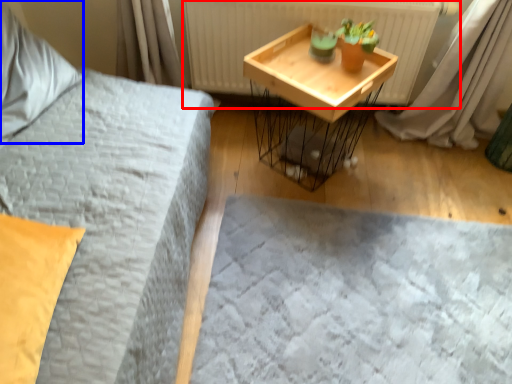
Question: Which object appears closest to the camera in this image, radiator (highlighted by a red box) or pillow (highlighted by a blue box)?

Choices:
 (A) radiator
 (B) pillow

Answer: (B)